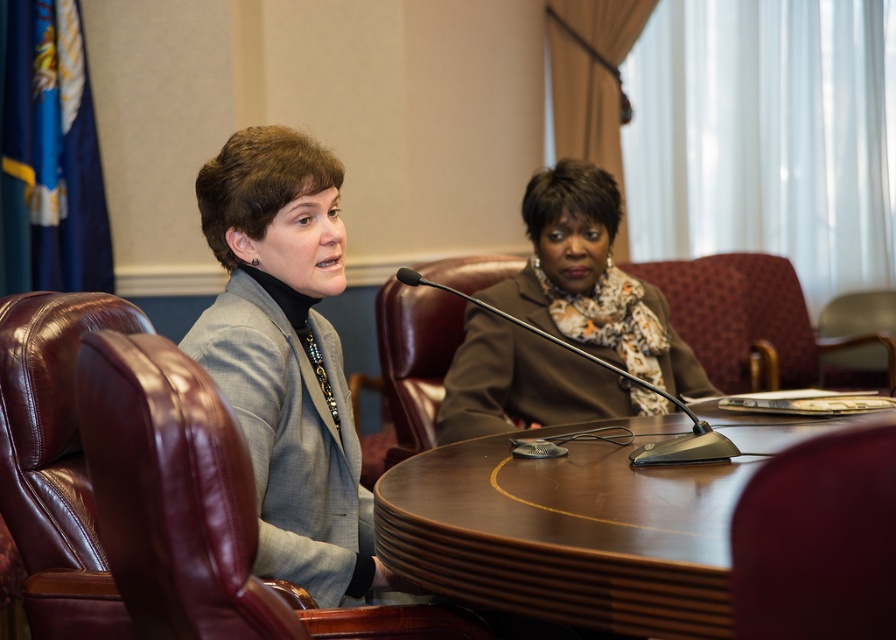
Question: Which point is closer to the camera?

Choices:
 (A) black plastic microphone at center
 (B) shiny brown leather chair at left

Answer: (B)

Question: Is leather chair at lower right thinner than leather chair at center?

Choices:
 (A) yes
 (B) no

Answer: (A)

Question: Which point is closer to the camera?

Choices:
 (A) brown leather chair at center
 (B) leather chair at center
 (C) leather chair at lower right
 (D) shiny brown leather chair at left

Answer: (C)

Question: Does leather chair at left have a greater width compared to shiny brown leather chair at left?

Choices:
 (A) yes
 (B) no

Answer: (B)

Question: Can you confirm if leather chair at lower right is positioned above black plastic microphone at center?

Choices:
 (A) yes
 (B) no

Answer: (B)

Question: Which of the following is the closest to the observer?

Choices:
 (A) black plastic microphone at center
 (B) brown wood table at center
 (C) leather chair at left
 (D) brown leather chair at center

Answer: (C)